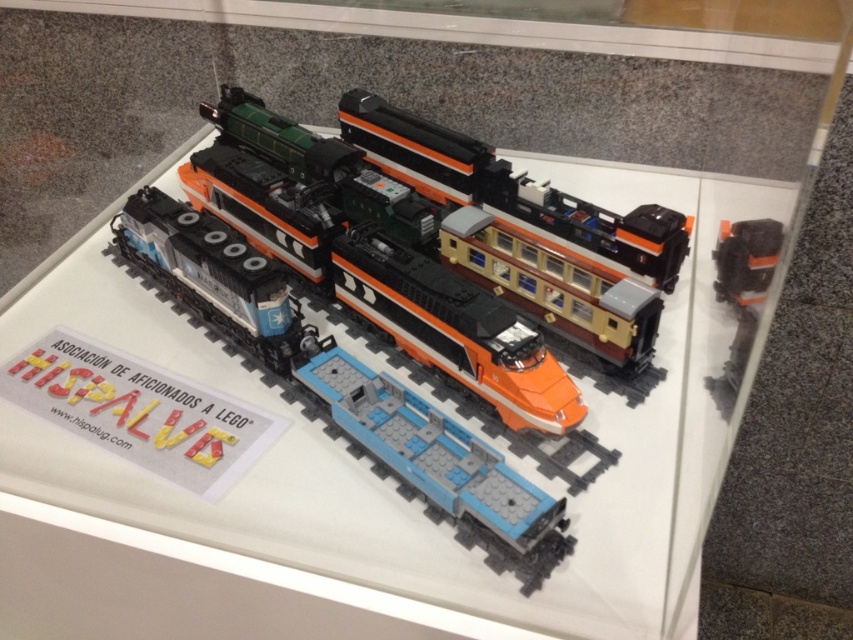
Question: Does orange matte train car at center appear on the left side of orange matte train car at upper right?

Choices:
 (A) yes
 (B) no

Answer: (A)

Question: Does orange matte train at center come in front of orange matte train car at center?

Choices:
 (A) yes
 (B) no

Answer: (A)

Question: Is orange matte train at center thinner than orange matte train car at upper right?

Choices:
 (A) no
 (B) yes

Answer: (A)

Question: Which point is closer to the camera?

Choices:
 (A) orange matte train at center
 (B) orange matte train car at upper right
 (C) orange matte train car at center

Answer: (A)

Question: Which of these objects is positioned farthest from the orange matte train car at center?

Choices:
 (A) orange matte train at center
 (B) orange matte train car at upper right

Answer: (B)

Question: Among these objects, which one is nearest to the camera?

Choices:
 (A) orange matte train at center
 (B) orange matte train car at center
 (C) orange matte train car at upper right

Answer: (A)